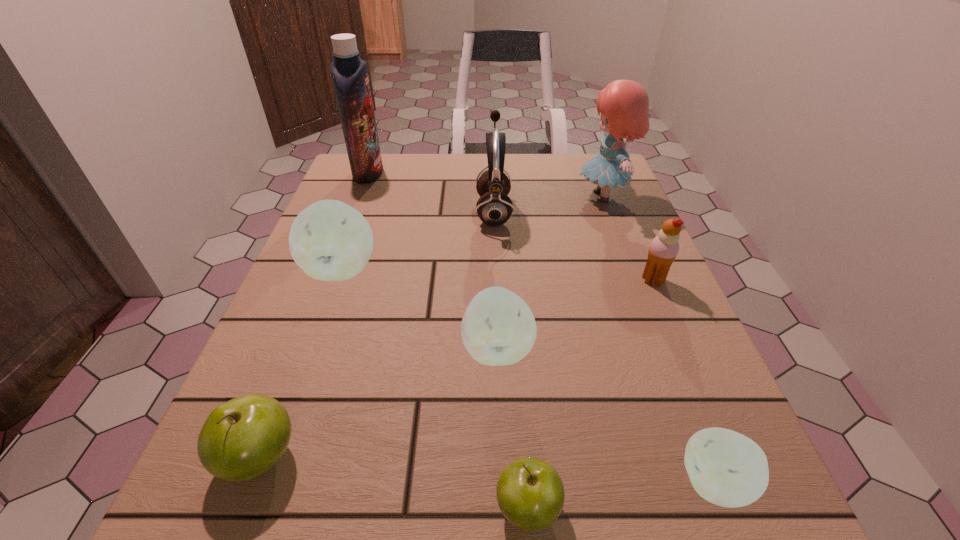
I want to click on blue shampoo, so click(x=349, y=72).

This screenshot has height=540, width=960. I want to click on the tallest object, so click(x=349, y=72).

Locate an element on the screen. blue doll is located at coordinates (624, 104).

Find the location of a particular element. The image size is (960, 540). the eighth shortest object is located at coordinates (624, 104).

Where is `the third tallest object`? the third tallest object is located at coordinates (494, 207).

Find the location of `brown earphone`. brown earphone is located at coordinates (494, 207).

Image resolution: width=960 pixels, height=540 pixels. What are the coordinates of `icecream` in the screenshot? It's located at (664, 248).

The height and width of the screenshot is (540, 960). Identify the location of the farthest white apple. (329, 240).

At what (x,y) coordinates should I click in order to perform the action: click on the biggest white apple. Please return your answer as a coordinate pair (x, y). The image size is (960, 540). Looking at the image, I should click on coord(329,240).

At what (x,y) coordinates should I click in order to perform the action: click on the second biggest white apple. Please return your answer as a coordinate pair (x, y). This screenshot has width=960, height=540. Looking at the image, I should click on (498, 328).